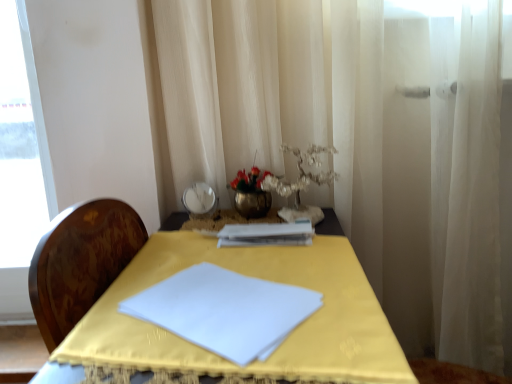
Find the location of a particular element. empty space that is to the right of white paper journal at center is located at coordinates (328, 237).